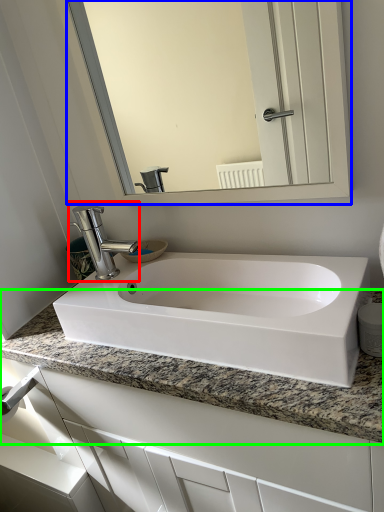
Question: Which object is the closest to the tap (highlighted by a red box)? Choose among these: mirror (highlighted by a blue box) or countertop (highlighted by a green box).

Choices:
 (A) mirror
 (B) countertop

Answer: (B)